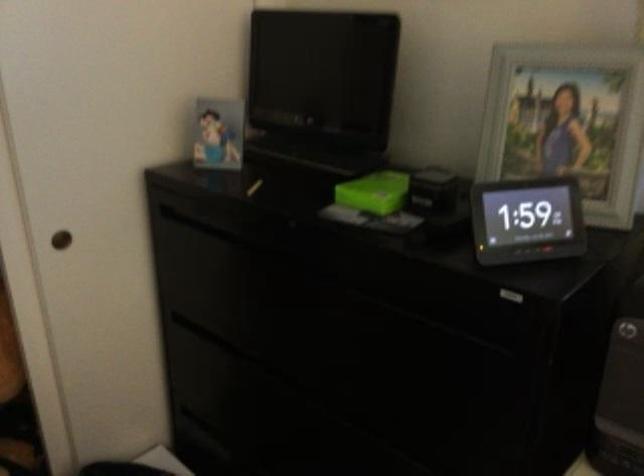
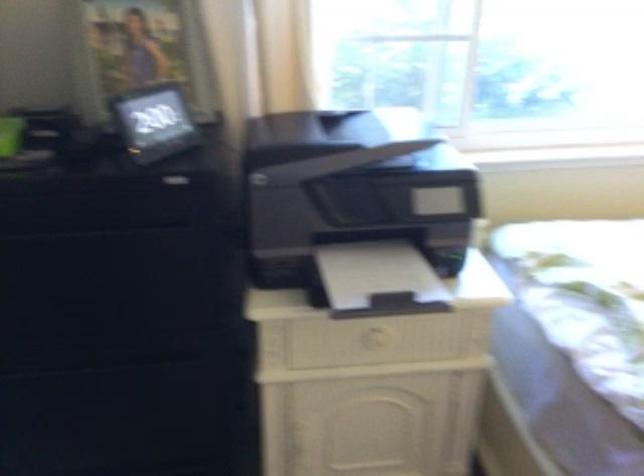
Question: Based on the continuous images, in which direction is the camera rotating? Reply with the corresponding letter.

Choices:
 (A) Left
 (B) Right
 (C) Up
 (D) Down

Answer: (B)